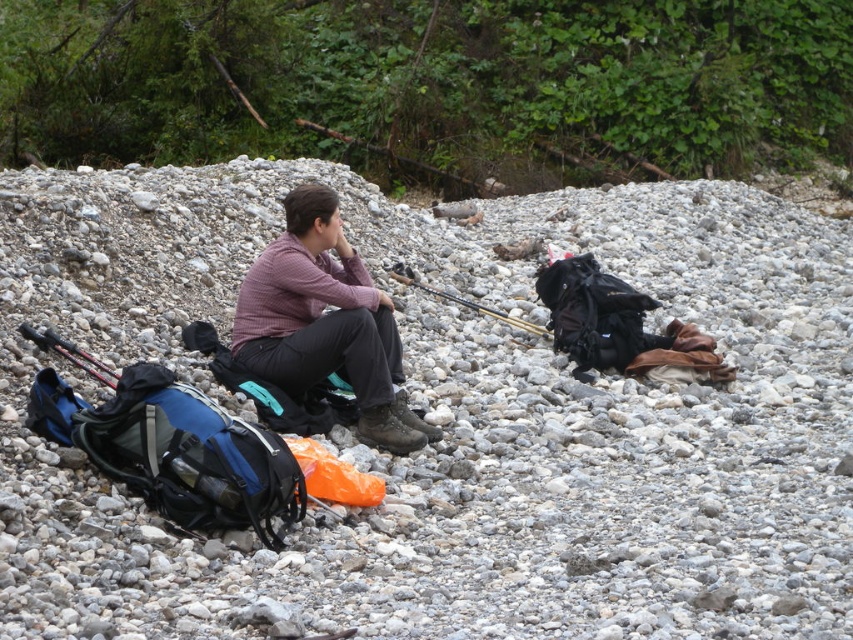
Question: Which object appears farthest from the camera in this image?

Choices:
 (A) matte purple shirt at center
 (B) matte black fishing pole at center

Answer: (B)

Question: From the image, what is the correct spatial relationship of matte purple shirt at center in relation to matte black fishing pole at center?

Choices:
 (A) right
 (B) left

Answer: (B)

Question: Which object appears closest to the camera in this image?

Choices:
 (A) matte purple shirt at center
 (B) matte black fishing pole at center

Answer: (A)

Question: Where is matte purple shirt at center located in relation to matte black fishing pole at center in the image?

Choices:
 (A) right
 (B) left

Answer: (B)

Question: Does matte purple shirt at center appear on the left side of matte black fishing pole at center?

Choices:
 (A) yes
 (B) no

Answer: (A)